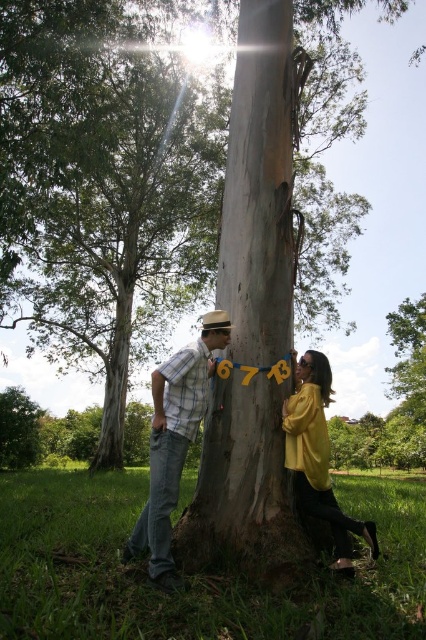
Question: Estimate the real-world distances between objects in this image. Which object is farther from the plaid shirt at center?

Choices:
 (A) smooth bark tree trunk at center
 (B) yellow matte jacket at center

Answer: (A)

Question: From the image, what is the correct spatial relationship of smooth bark tree trunk at center in relation to yellow matte jacket at center?

Choices:
 (A) above
 (B) below

Answer: (A)

Question: Which object appears closest to the camera in this image?

Choices:
 (A) plaid shirt at center
 (B) yellow matte jacket at center
 (C) smooth gray bark at center
 (D) smooth bark tree trunk at center

Answer: (A)

Question: Is smooth bark tree trunk at center positioned in front of plaid shirt at center?

Choices:
 (A) no
 (B) yes

Answer: (A)

Question: Estimate the real-world distances between objects in this image. Which object is farther from the smooth gray bark at center?

Choices:
 (A) yellow matte jacket at center
 (B) plaid shirt at center

Answer: (B)

Question: Does smooth bark tree trunk at center appear on the left side of plaid shirt at center?

Choices:
 (A) no
 (B) yes

Answer: (A)